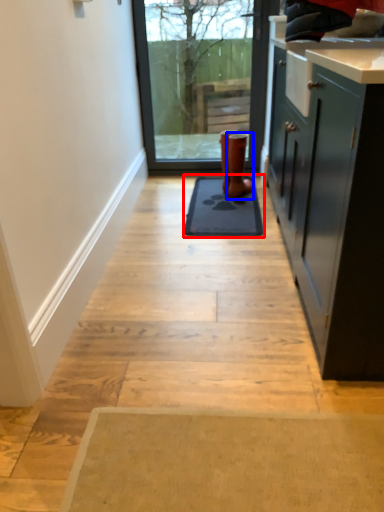
Question: Which of the following is the farthest to the observer, mat (highlighted by a red box) or footwear (highlighted by a blue box)?

Choices:
 (A) mat
 (B) footwear

Answer: (B)